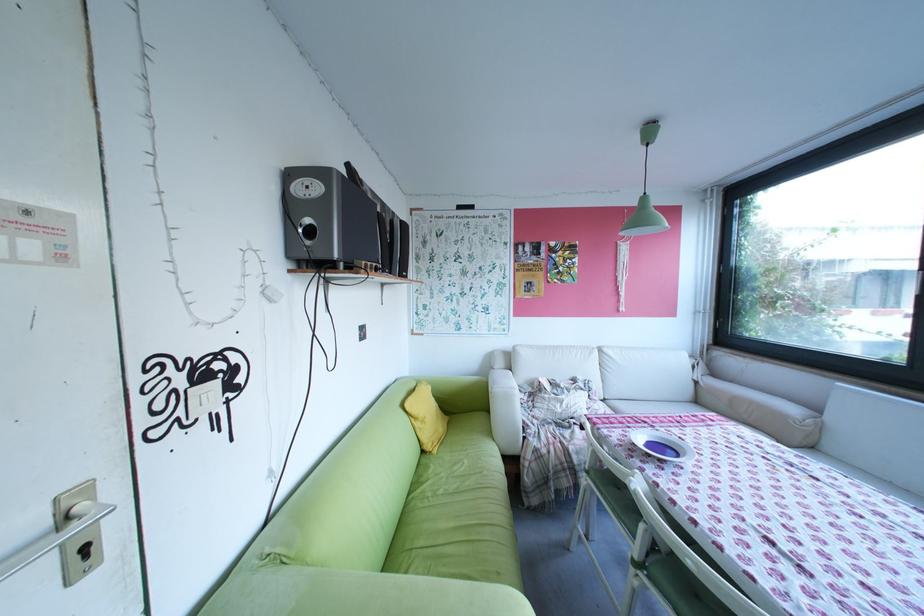
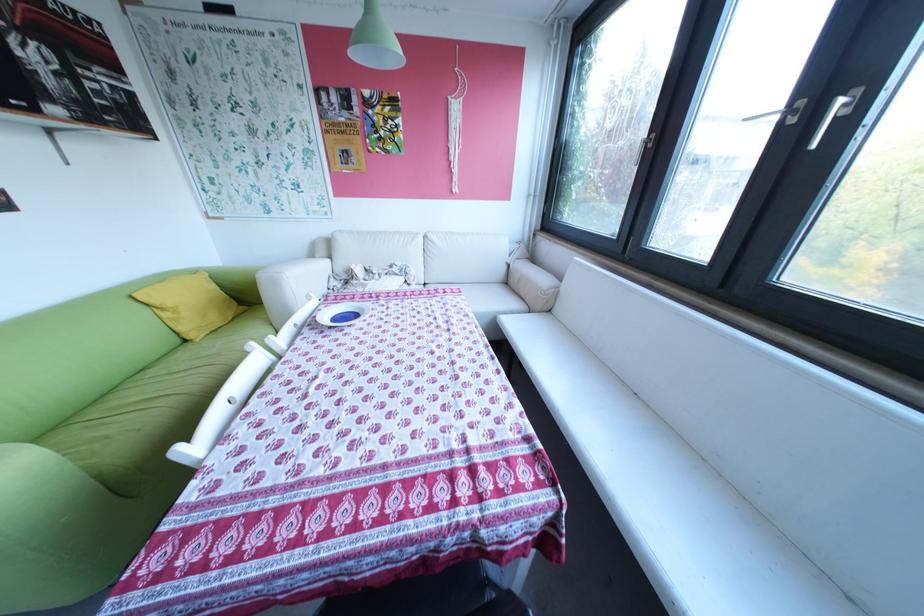
The point at (430, 424) is marked in the first image. Where is the corresponding point in the second image?

(177, 314)